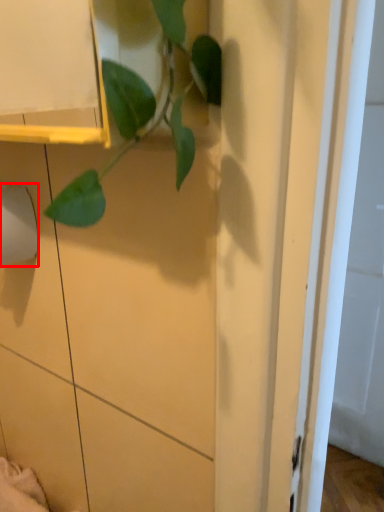
Question: Observing the image, what is the correct spatial positioning of toilet paper (annotated by the red box) in reference to houseplant?

Choices:
 (A) left
 (B) right

Answer: (A)